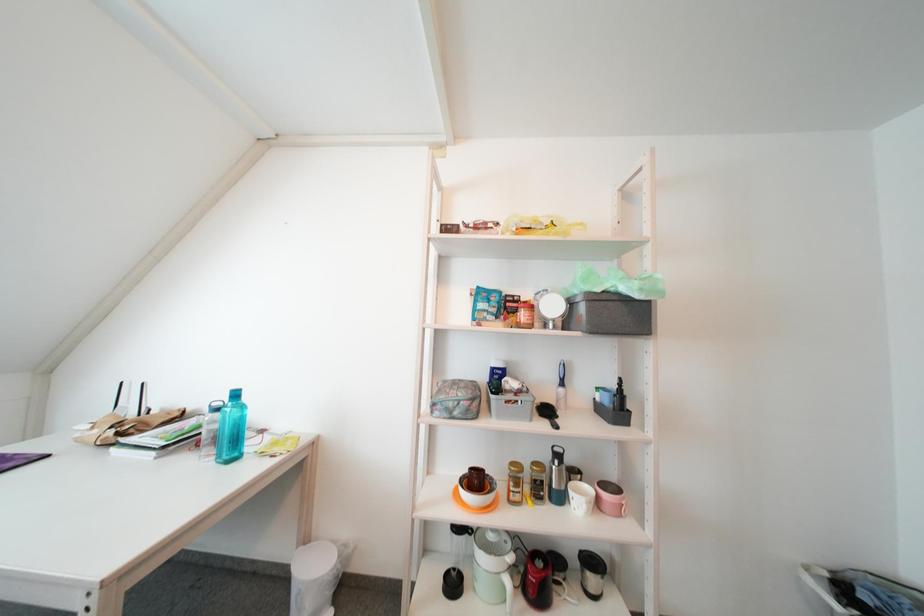
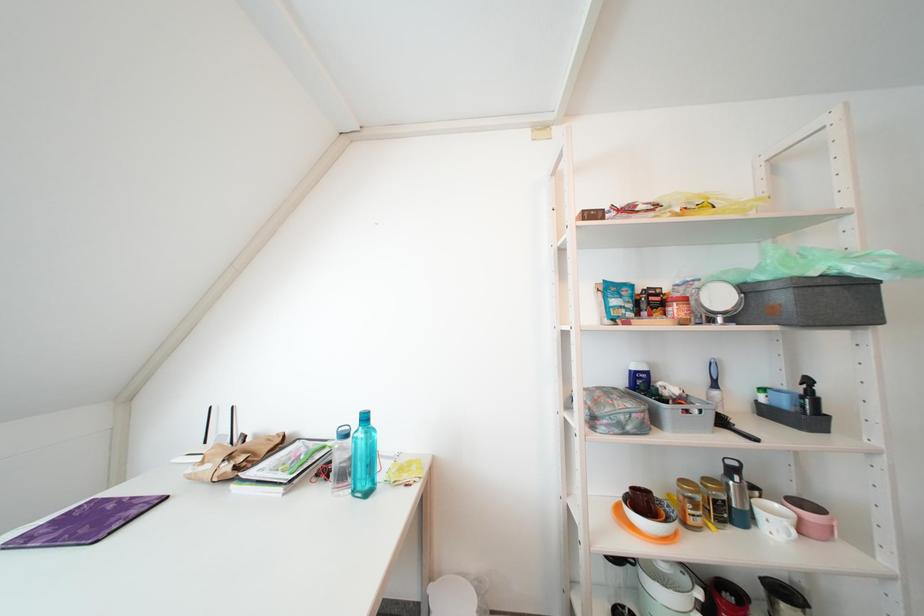
Question: The images are taken continuously from a first-person perspective. In which direction are you moving?

Choices:
 (A) Left
 (B) Right
 (C) Forward
 (D) Backward

Answer: (A)